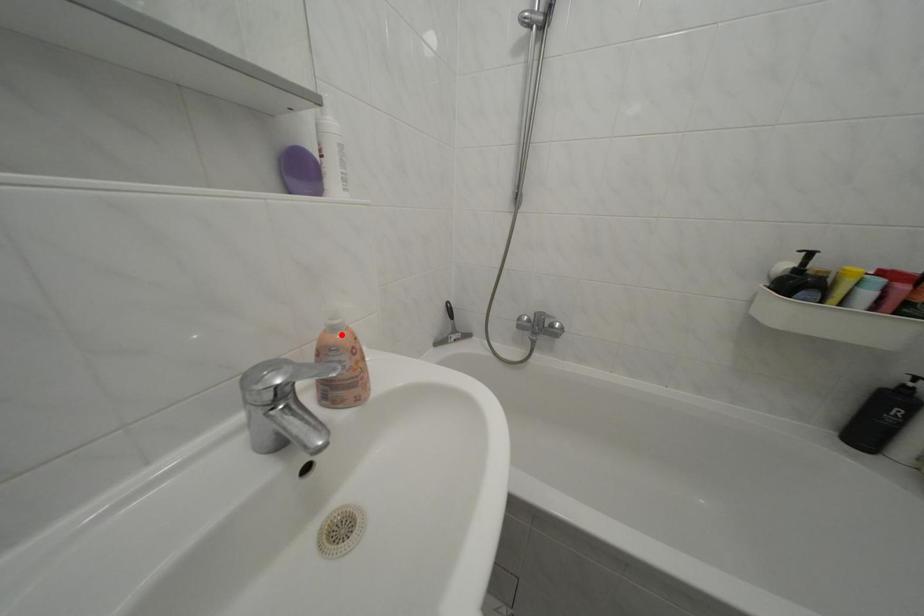
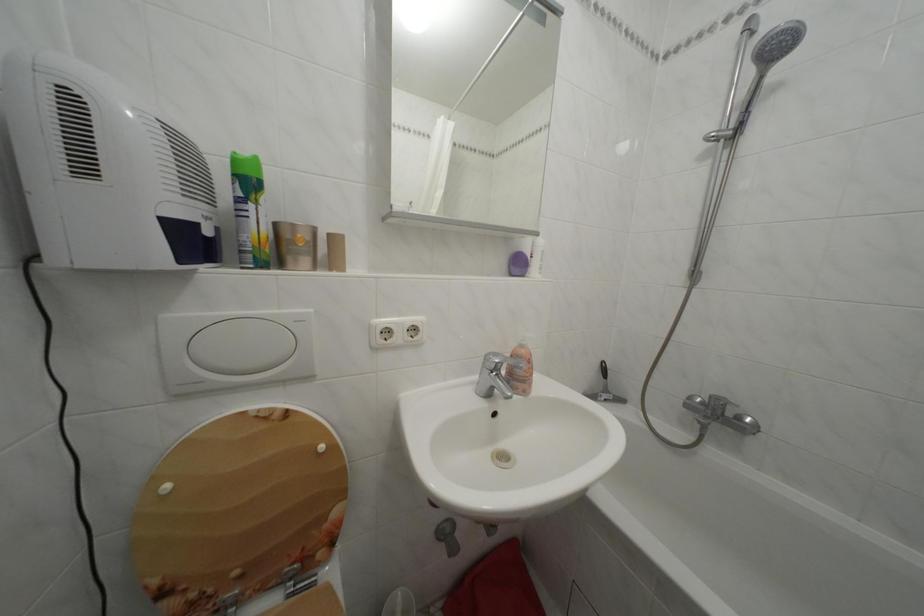
Locate, in the second image, the point that corresponds to the highlighted location in the first image.

(530, 352)